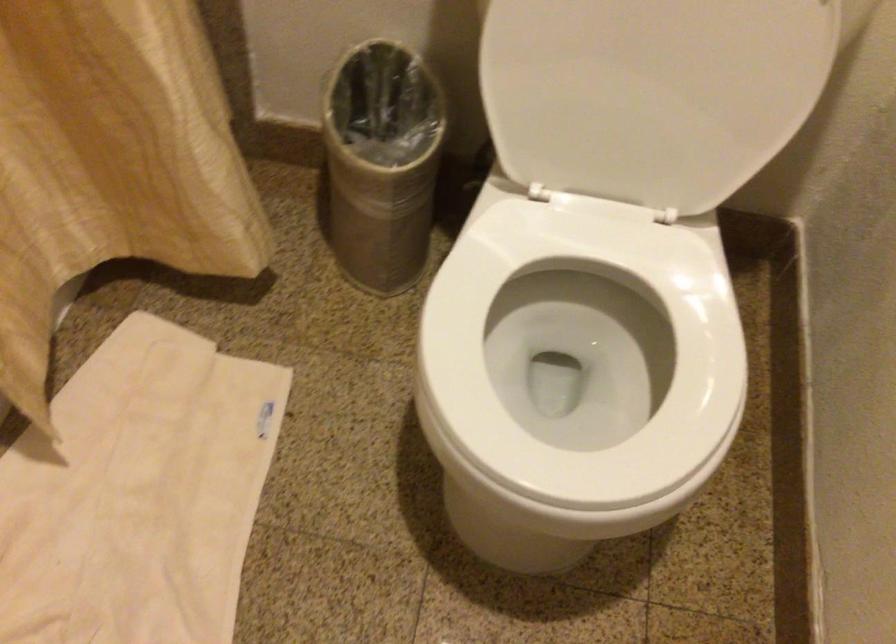
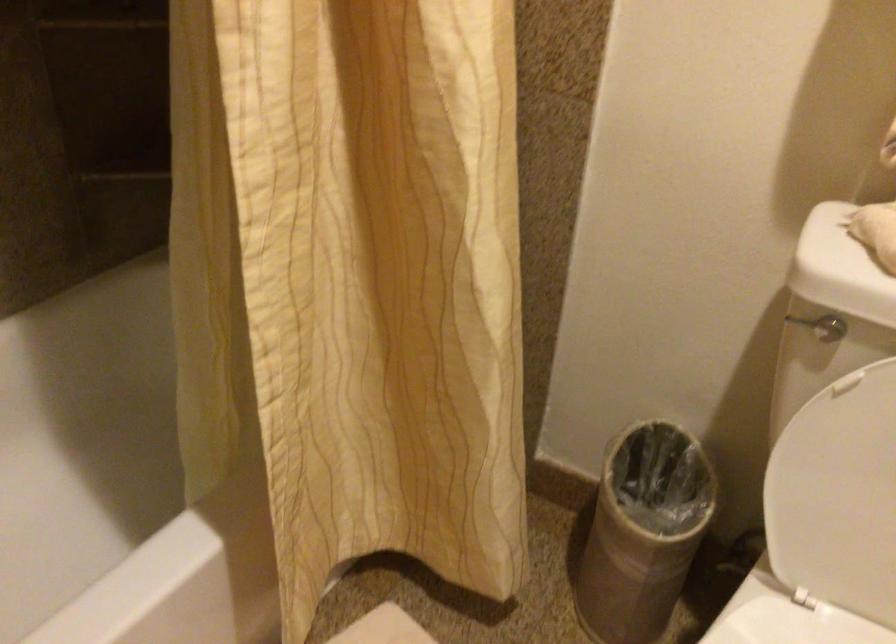
Find the pixel in the second image that matches (376,167) in the first image.

(643, 532)